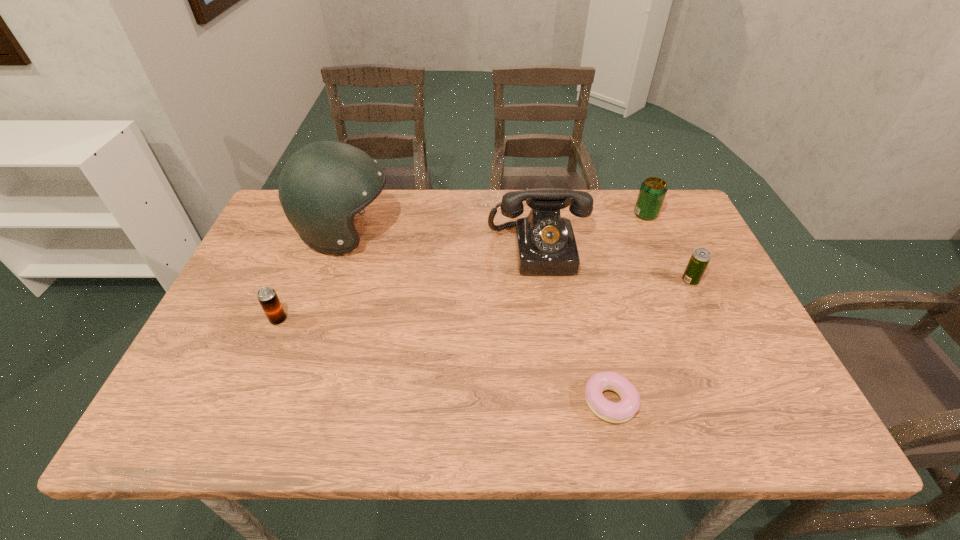
Where is `free space that satisfies the following two spatial constraints: 1. on the dial of the shortest object; 2. on the right side of the fifth shortest object`? This screenshot has height=540, width=960. free space that satisfies the following two spatial constraints: 1. on the dial of the shortest object; 2. on the right side of the fifth shortest object is located at coordinates (560, 402).

Locate an element on the screen. Image resolution: width=960 pixels, height=540 pixels. free space that satisfies the following two spatial constraints: 1. at the face opening of the second nearest beer can; 2. on the left side of the football helmet is located at coordinates (329, 281).

Find the location of a particular element. Image resolution: width=960 pixels, height=540 pixels. free space that satisfies the following two spatial constraints: 1. on the dial of the second nearest beer can; 2. on the right side of the second tallest object is located at coordinates (542, 281).